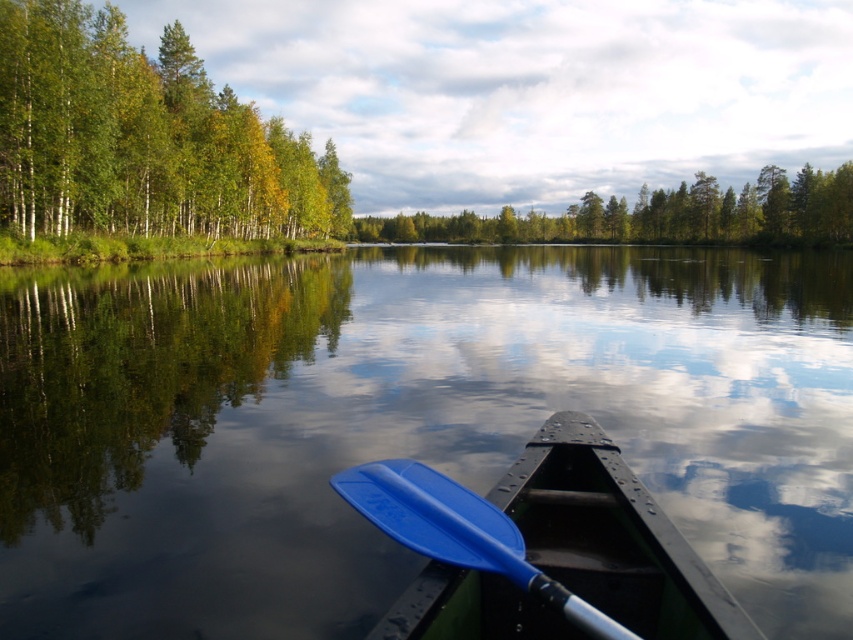
Question: Which object is closer to the camera taking this photo?

Choices:
 (A) green matte trees at left
 (B) blue plastic paddle at lower center
 (C) transparent water at center
 (D) green matte tree at center

Answer: (B)

Question: Is green matte trees at left above blue plastic paddle at lower center?

Choices:
 (A) no
 (B) yes

Answer: (B)

Question: Which of the following is the farthest from the observer?

Choices:
 (A) blue plastic paddle at lower center
 (B) green matte trees at left
 (C) green matte tree at center
 (D) transparent water at center

Answer: (C)

Question: Which point is farther to the camera?

Choices:
 (A) coord(22,230)
 (B) coord(653,234)
 (C) coord(171,602)
 (D) coord(395,470)

Answer: (B)

Question: Is transparent water at center bigger than blue plastic paddle at lower center?

Choices:
 (A) yes
 (B) no

Answer: (A)

Question: Observing the image, what is the correct spatial positioning of transparent water at center in reference to green matte trees at left?

Choices:
 (A) above
 (B) below

Answer: (B)